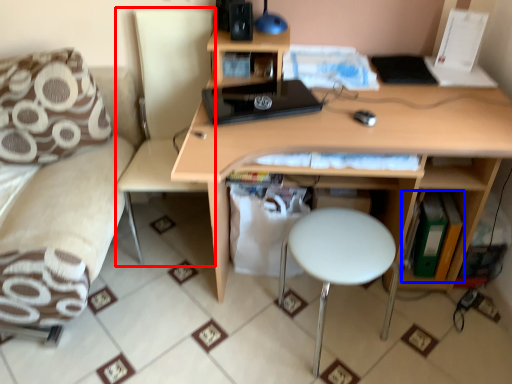
Question: Which object appears closest to the camera in this image, swivel chair (highlighted by a red box) or book (highlighted by a blue box)?

Choices:
 (A) swivel chair
 (B) book

Answer: (A)